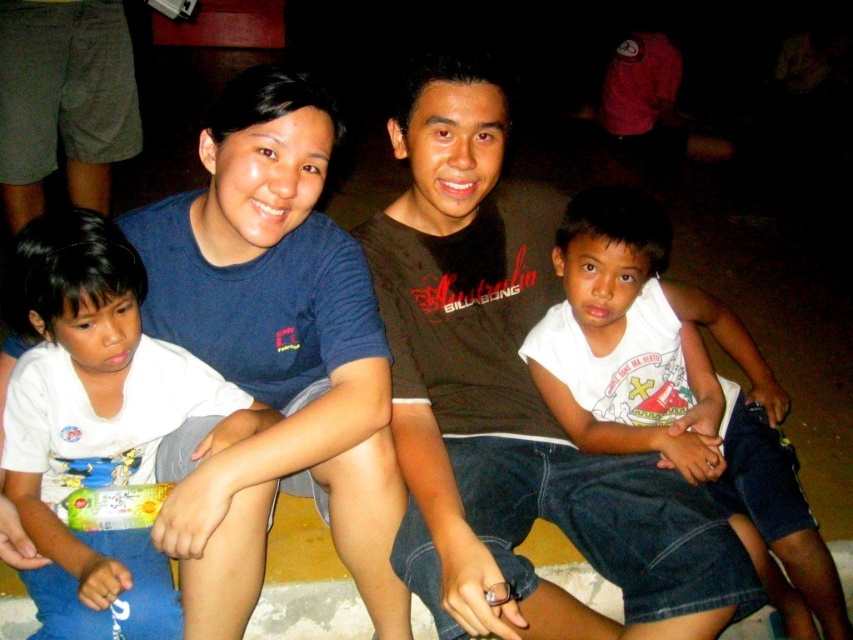
You are a photographer trying to focus on the white cotton shirt at left. Can you adjust your camera settings to capture it clearly if the camera has a maximum focus range of 1.5 meters?

The white cotton shirt at left is 1.39 meters away from camera, so yes, the camera can focus on it clearly since the distance is within the maximum focus range of 1.5 meters.

You are a photographer trying to capture a group photo of two adults and two children sitting together. You notice the brown cotton shirt at center and the white cotton shirt at left in the frame. Which shirt should you adjust to ensure proper alignment between the two adults?

The brown cotton shirt at center is positioned on the right side of the white cotton shirt at left. To ensure proper alignment between the two adults, you should adjust the brown cotton shirt at center to move it to the left so it aligns better with the white cotton shirt at left.

You are a photographer trying to adjust the lighting for a group photo. You notice two white cotton shirts in the image. Which one is closer to the camera, the white cotton shirt at left or the white cotton shirt at lower right?

The white cotton shirt at left is shorter than the white cotton shirt at lower right, so the white cotton shirt at left is closer to the camera.